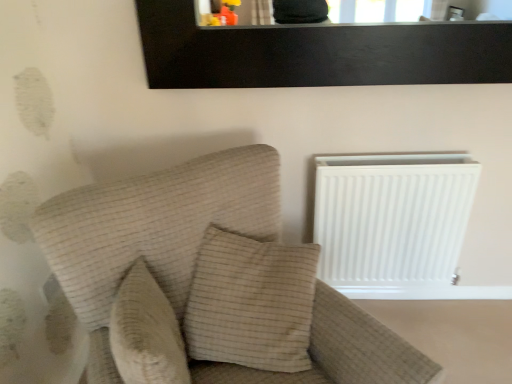
Question: Does beige textured pillow at center, positioned as the 1th pillow in left-to-right order, appear on the right side of beige fabric couch at left?

Choices:
 (A) no
 (B) yes

Answer: (A)

Question: From the image's perspective, would you say beige textured pillow at center, positioned as the second pillow in right-to-left order, is positioned over beige fabric couch at left?

Choices:
 (A) no
 (B) yes

Answer: (B)

Question: From a real-world perspective, does beige textured pillow at center, positioned as the 1th pillow in left-to-right order, sit lower than beige fabric couch at left?

Choices:
 (A) yes
 (B) no

Answer: (B)

Question: Is beige textured pillow at center, positioned as the second pillow in right-to-left order, thinner than beige fabric couch at left?

Choices:
 (A) no
 (B) yes

Answer: (B)

Question: Can you confirm if beige textured pillow at center, positioned as the 1th pillow in left-to-right order, is wider than beige fabric couch at left?

Choices:
 (A) no
 (B) yes

Answer: (A)

Question: Would you say beige textured pillow at center, positioned as the second pillow in right-to-left order, is to the left or to the right of white matte radiator at right in the picture?

Choices:
 (A) right
 (B) left

Answer: (B)

Question: Is beige textured pillow at center, positioned as the second pillow in right-to-left order, in front of or behind white matte radiator at right in the image?

Choices:
 (A) behind
 (B) front

Answer: (B)

Question: From a real-world perspective, relative to white matte radiator at right, is beige textured pillow at center, positioned as the 1th pillow in left-to-right order, vertically above or below?

Choices:
 (A) below
 (B) above

Answer: (B)

Question: From the image's perspective, is beige textured pillow at center, positioned as the second pillow in right-to-left order, positioned above or below white matte radiator at right?

Choices:
 (A) below
 (B) above

Answer: (A)

Question: Based on their positions, is beige fabric couch at left located to the left or right of white matte radiator at right?

Choices:
 (A) left
 (B) right

Answer: (A)

Question: Considering the positions of beige fabric couch at left and white matte radiator at right in the image, is beige fabric couch at left taller or shorter than white matte radiator at right?

Choices:
 (A) short
 (B) tall

Answer: (B)

Question: In terms of width, does beige fabric couch at left look wider or thinner when compared to white matte radiator at right?

Choices:
 (A) thin
 (B) wide

Answer: (B)

Question: Does point (36, 226) appear closer or farther from the camera than point (389, 178)?

Choices:
 (A) farther
 (B) closer

Answer: (B)

Question: Considering the positions of point (309, 281) and point (124, 339), is point (309, 281) closer or farther from the camera than point (124, 339)?

Choices:
 (A) farther
 (B) closer

Answer: (A)

Question: In the image, is beige textured pillow at center, which is the first pillow in right-to-left order, on the left side or the right side of beige textured pillow at center, positioned as the second pillow in right-to-left order?

Choices:
 (A) right
 (B) left

Answer: (A)